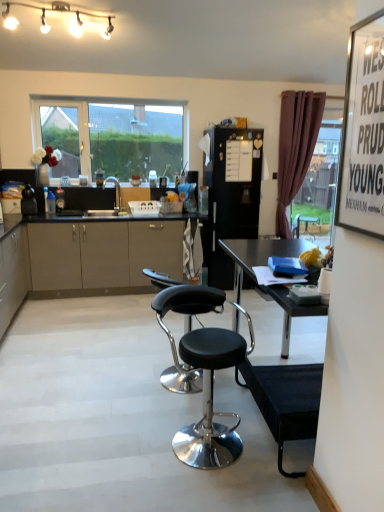
Question: From a real-world perspective, is matte beige cabinet at lower left positioned under clear glass window at upper center based on gravity?

Choices:
 (A) yes
 (B) no

Answer: (A)

Question: Would you say matte beige cabinet at lower left contains clear glass window at upper center?

Choices:
 (A) yes
 (B) no

Answer: (B)

Question: Can you confirm if matte beige cabinet at lower left is bigger than clear glass window at upper center?

Choices:
 (A) no
 (B) yes

Answer: (B)

Question: Does matte beige cabinet at lower left have a lesser height compared to clear glass window at upper center?

Choices:
 (A) no
 (B) yes

Answer: (B)

Question: From the image's perspective, would you say matte beige cabinet at lower left is positioned over clear glass window at upper center?

Choices:
 (A) yes
 (B) no

Answer: (B)

Question: Visually, is black plastic camera at left, acting as the second appliance starting from the back, positioned to the left or to the right of black leather stool at center, positioned as the 1th chair in back-to-front order?

Choices:
 (A) left
 (B) right

Answer: (A)

Question: Is point click(24, 196) closer or farther from the camera than point click(196, 286)?

Choices:
 (A) closer
 (B) farther

Answer: (B)

Question: Considering the positions of black plastic camera at left, acting as the second appliance starting from the back, and black leather stool at center, positioned as the 1th chair in back-to-front order, in the image, is black plastic camera at left, acting as the second appliance starting from the back, wider or thinner than black leather stool at center, positioned as the 1th chair in back-to-front order,?

Choices:
 (A) thin
 (B) wide

Answer: (A)

Question: From the image's perspective, relative to black leather stool at center, the 2th chair viewed from the front, is black plastic camera at left, which appears as the second appliance when viewed from the right, above or below?

Choices:
 (A) below
 (B) above

Answer: (B)

Question: From the image's perspective, is white glossy string lights at upper center positioned above or below matte beige cabinet at lower left?

Choices:
 (A) below
 (B) above

Answer: (B)

Question: Is point (56, 10) positioned closer to the camera than point (26, 276)?

Choices:
 (A) closer
 (B) farther

Answer: (A)

Question: From a real-world perspective, relative to matte beige cabinet at lower left, is white glossy string lights at upper center vertically above or below?

Choices:
 (A) above
 (B) below

Answer: (A)

Question: Is white glossy string lights at upper center in front of or behind matte beige cabinet at lower left in the image?

Choices:
 (A) front
 (B) behind

Answer: (A)

Question: Is black matte refrigerator at center, the first appliance when ordered from right to left, to the left or to the right of black plastic table at center in the image?

Choices:
 (A) right
 (B) left

Answer: (B)

Question: Which is correct: black matte refrigerator at center, which appears as the first appliance when viewed from the back, is inside black plastic table at center, or outside of it?

Choices:
 (A) outside
 (B) inside

Answer: (A)